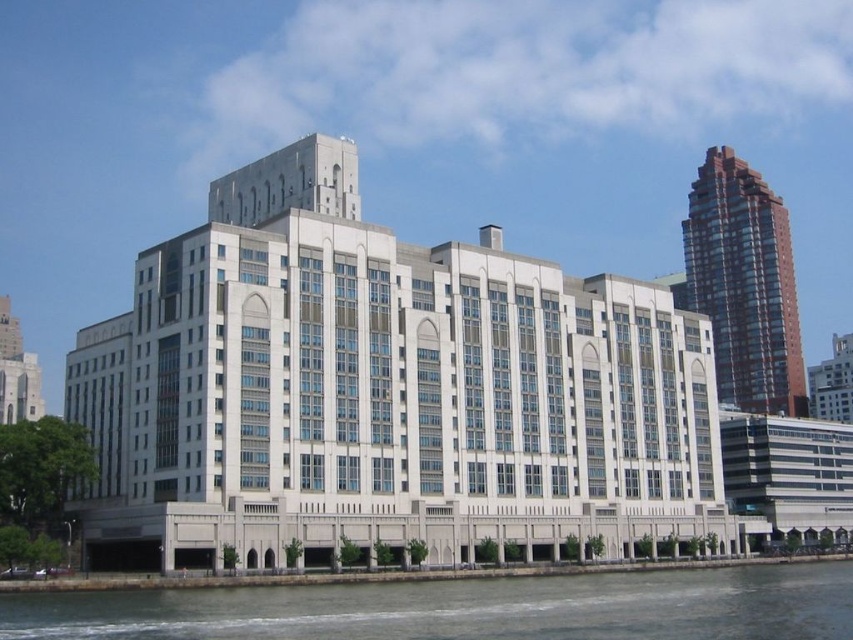
You are standing at the waterfront looking at the gray water at lower center and the brown glassy tower at upper right. Which object appears closer to you based on their positions in the image?

The gray water at lower center appears closer to you because it is positioned in front of the brown glassy tower at upper right.

You are standing on the waterfront and see the white stone building at center and the gray water at lower center. Which object is higher in elevation?

The white stone building at center is taller than the gray water at lower center, so the white stone building at center is higher in elevation.

You are an architect evaluating the spatial relationship between the gray water at lower center and the brown glassy tower at upper right in the image. Which object appears taller?

The brown glassy tower at upper right appears taller than the gray water at lower center.